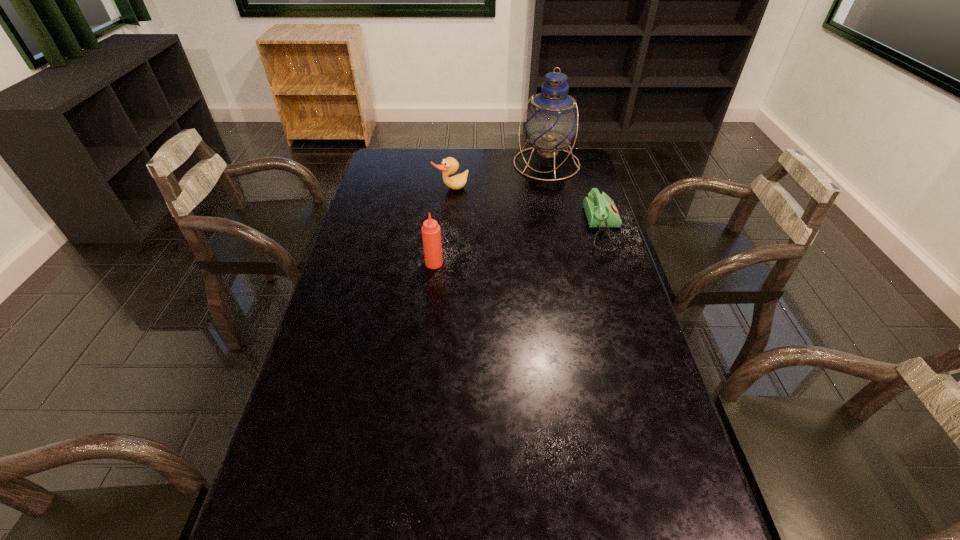
The width and height of the screenshot is (960, 540). I want to click on blank space located on the beak of the second farthest object, so click(x=507, y=234).

This screenshot has height=540, width=960. In order to click on blank space located on the beak of the second farthest object in this screenshot , I will do `click(516, 242)`.

Find the location of a particular element. The image size is (960, 540). free spot located on the beak of the second farthest object is located at coordinates (492, 221).

Where is `object situated at the far edge`? The height and width of the screenshot is (540, 960). object situated at the far edge is located at coordinates (551, 122).

Where is `telephone present at the right edge`? telephone present at the right edge is located at coordinates (600, 210).

The height and width of the screenshot is (540, 960). What are the coordinates of `lantern located at the right edge` in the screenshot? It's located at (551, 122).

Image resolution: width=960 pixels, height=540 pixels. I want to click on object present at the far right corner, so click(x=551, y=122).

Locate an element on the screen. This screenshot has height=540, width=960. vacant space at the far edge of the desktop is located at coordinates (494, 160).

I want to click on free location at the near edge of the desktop, so click(x=436, y=499).

At what (x,y) coordinates should I click in order to perform the action: click on vacant region at the right edge of the desktop. Please return your answer as a coordinate pair (x, y). Image resolution: width=960 pixels, height=540 pixels. Looking at the image, I should click on (655, 432).